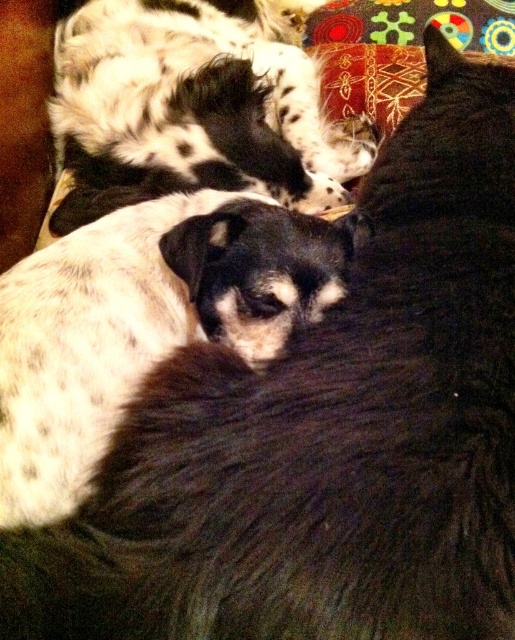
Question: Can you confirm if spotted fur dog at center is smaller than spotted fur dog at upper left?

Choices:
 (A) no
 (B) yes

Answer: (B)

Question: Does spotted fur dog at center appear on the left side of spotted fur dog at upper left?

Choices:
 (A) no
 (B) yes

Answer: (B)

Question: Can you confirm if spotted fur dog at center is positioned above spotted fur dog at upper left?

Choices:
 (A) no
 (B) yes

Answer: (A)

Question: Which point is closer to the camera?

Choices:
 (A) (96, 301)
 (B) (276, 131)

Answer: (A)